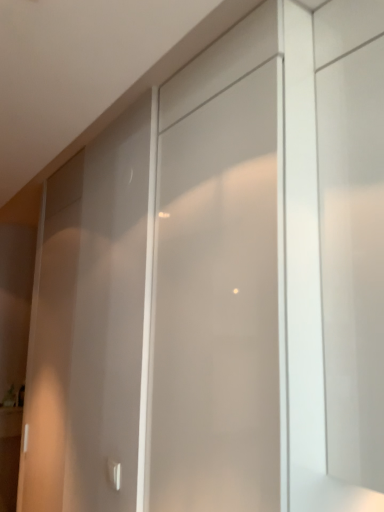
In order to face white glossy door handle at lower left, should I rotate leftwards or rightwards?

It's best to rotate left around 10.805 degrees.

Measure the distance between point (x=118, y=474) and camera.

1.50 meters.

Describe the element at coordinates (114, 473) in the screenshot. I see `white glossy door handle at lower left` at that location.

At what (x,y) coordinates should I click in order to perform the action: click on white glossy door handle at lower left. Please return your answer as a coordinate pair (x, y). The height and width of the screenshot is (512, 384). Looking at the image, I should click on (114, 473).

This screenshot has width=384, height=512. What do you see at coordinates (219, 304) in the screenshot? I see `frosted glass screen door at center` at bounding box center [219, 304].

You are a GUI agent. You are given a task and a screenshot of the screen. Output one action in this format:
    pyautogui.click(x=<x>, y=<y>)
    Task: Click on the frosted glass screen door at center
    This screenshot has height=512, width=384.
    Given the screenshot: What is the action you would take?
    pyautogui.click(x=219, y=304)

This screenshot has width=384, height=512. Find the location of `white glossy door handle at lower left`. white glossy door handle at lower left is located at coordinates (114, 473).

Based on their positions, is frosted glass screen door at center located to the left or right of white glossy door handle at lower left?

frosted glass screen door at center is to the right of white glossy door handle at lower left.

In the image, is frosted glass screen door at center positioned in front of or behind white glossy door handle at lower left?

frosted glass screen door at center is in front of white glossy door handle at lower left.

Which is behind, point (213, 447) or point (115, 479)?

Point (115, 479)

From the image's perspective, between frosted glass screen door at center and white glossy door handle at lower left, who is located below?

white glossy door handle at lower left, from the image's perspective.

From a real-world perspective, is frosted glass screen door at center positioned above or below white glossy door handle at lower left?

From a real-world perspective, frosted glass screen door at center is physically above white glossy door handle at lower left.

Can you confirm if frosted glass screen door at center is thinner than white glossy door handle at lower left?

In fact, frosted glass screen door at center might be wider than white glossy door handle at lower left.

Considering the sizes of frosted glass screen door at center and white glossy door handle at lower left in the image, is frosted glass screen door at center taller or shorter than white glossy door handle at lower left?

Clearly, frosted glass screen door at center is taller compared to white glossy door handle at lower left.

From the picture: Based on their sizes in the image, would you say frosted glass screen door at center is bigger or smaller than white glossy door handle at lower left?

Considering their sizes, frosted glass screen door at center takes up more space than white glossy door handle at lower left.

Is frosted glass screen door at center outside of white glossy door handle at lower left?

Yes, frosted glass screen door at center is not within white glossy door handle at lower left.

Would you consider frosted glass screen door at center to be distant from white glossy door handle at lower left?

Actually, frosted glass screen door at center and white glossy door handle at lower left are a little close together.

Is white glossy door handle at lower left at the back of frosted glass screen door at center?

That's not correct — frosted glass screen door at center is not looking away from white glossy door handle at lower left.

How different are the orientations of frosted glass screen door at center and white glossy door handle at lower left in degrees?

There is a 0.213-degree angle between the facing directions of frosted glass screen door at center and white glossy door handle at lower left.

Locate an element on the screen. screen door on the right of the white glossy door handle at lower left is located at coordinates (219, 304).

Which object is positioned more to the left, white glossy door handle at lower left or frosted glass screen door at center?

white glossy door handle at lower left.

Who is more distant, white glossy door handle at lower left or frosted glass screen door at center?

white glossy door handle at lower left is further away from the camera.

Considering the positions of points (116, 483) and (198, 383), is point (116, 483) farther from camera compared to point (198, 383)?

Yes, it is behind point (198, 383).

From the image's perspective, who appears lower, white glossy door handle at lower left or frosted glass screen door at center?

white glossy door handle at lower left, from the image's perspective.

From a real-world perspective, is white glossy door handle at lower left on top of frosted glass screen door at center?

Incorrect, from a real-world perspective, white glossy door handle at lower left is lower than frosted glass screen door at center.

Considering the sizes of objects white glossy door handle at lower left and frosted glass screen door at center in the image provided, who is thinner, white glossy door handle at lower left or frosted glass screen door at center?

white glossy door handle at lower left.

From their relative heights in the image, would you say white glossy door handle at lower left is taller or shorter than frosted glass screen door at center?

In the image, white glossy door handle at lower left appears to be shorter than frosted glass screen door at center.

Who is bigger, white glossy door handle at lower left or frosted glass screen door at center?

Bigger between the two is frosted glass screen door at center.

Which is correct: white glossy door handle at lower left is inside frosted glass screen door at center, or outside of it?

white glossy door handle at lower left is not enclosed by frosted glass screen door at center.

Would you consider white glossy door handle at lower left to be distant from frosted glass screen door at center?

No.

Is white glossy door handle at lower left looking in the opposite direction of frosted glass screen door at center?

No, frosted glass screen door at center is not at the back of white glossy door handle at lower left.

How far apart are white glossy door handle at lower left and frosted glass screen door at center?

white glossy door handle at lower left and frosted glass screen door at center are 28.98 inches apart from each other.

I want to click on door handle lying below the frosted glass screen door at center (from the image's perspective), so click(x=114, y=473).

Where is `door handle on the left of frosted glass screen door at center`? The height and width of the screenshot is (512, 384). door handle on the left of frosted glass screen door at center is located at coordinates (114, 473).

Where is `door handle below the frosted glass screen door at center (from a real-world perspective)`? The width and height of the screenshot is (384, 512). door handle below the frosted glass screen door at center (from a real-world perspective) is located at coordinates (114, 473).